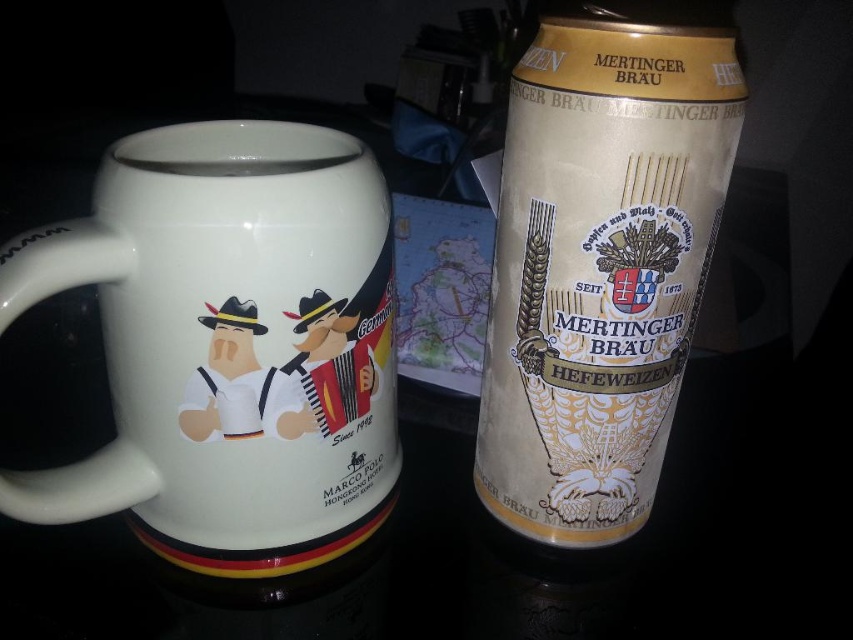
Is white ceramic mug at left thinner than gold matte beer can at right?

No.

Locate an element on the screen. white ceramic mug at left is located at coordinates (228, 346).